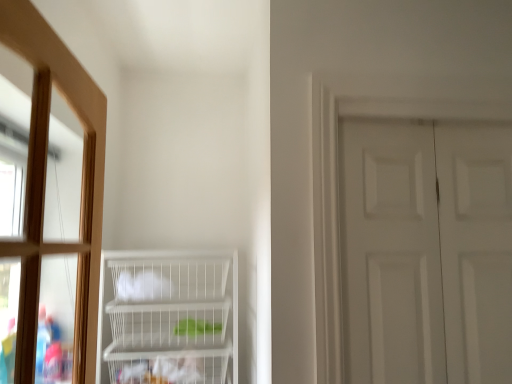
Question: Is clear glass window at left in contact with white wire basket at lower center?

Choices:
 (A) no
 (B) yes

Answer: (A)

Question: Does clear glass window at left appear on the right side of white wire basket at lower center?

Choices:
 (A) yes
 (B) no

Answer: (B)

Question: From the image's perspective, is clear glass window at left under white wire basket at lower center?

Choices:
 (A) no
 (B) yes

Answer: (A)

Question: Does clear glass window at left contain white wire basket at lower center?

Choices:
 (A) yes
 (B) no

Answer: (B)

Question: Is clear glass window at left wider than white wire basket at lower center?

Choices:
 (A) no
 (B) yes

Answer: (A)

Question: From the image's perspective, is clear glass window at left positioned above or below white matte door at right?

Choices:
 (A) below
 (B) above

Answer: (B)

Question: Considering the positions of point [x=31, y=134] and point [x=343, y=266], is point [x=31, y=134] closer or farther from the camera than point [x=343, y=266]?

Choices:
 (A) farther
 (B) closer

Answer: (B)

Question: From their relative heights in the image, would you say clear glass window at left is taller or shorter than white matte door at right?

Choices:
 (A) short
 (B) tall

Answer: (A)

Question: Is clear glass window at left wider or thinner than white matte door at right?

Choices:
 (A) thin
 (B) wide

Answer: (B)

Question: Considering the positions of white matte door at right and white wire basket at lower center in the image, is white matte door at right taller or shorter than white wire basket at lower center?

Choices:
 (A) short
 (B) tall

Answer: (B)

Question: From the image's perspective, is white matte door at right positioned above or below white wire basket at lower center?

Choices:
 (A) below
 (B) above

Answer: (B)

Question: From a real-world perspective, is white matte door at right above or below white wire basket at lower center?

Choices:
 (A) above
 (B) below

Answer: (A)

Question: Is white matte door at right in front of or behind white wire basket at lower center in the image?

Choices:
 (A) behind
 (B) front

Answer: (B)

Question: From a real-world perspective, is white matte door at right above or below clear glass window at left?

Choices:
 (A) below
 (B) above

Answer: (A)

Question: Does point (398, 322) appear closer or farther from the camera than point (38, 46)?

Choices:
 (A) closer
 (B) farther

Answer: (B)